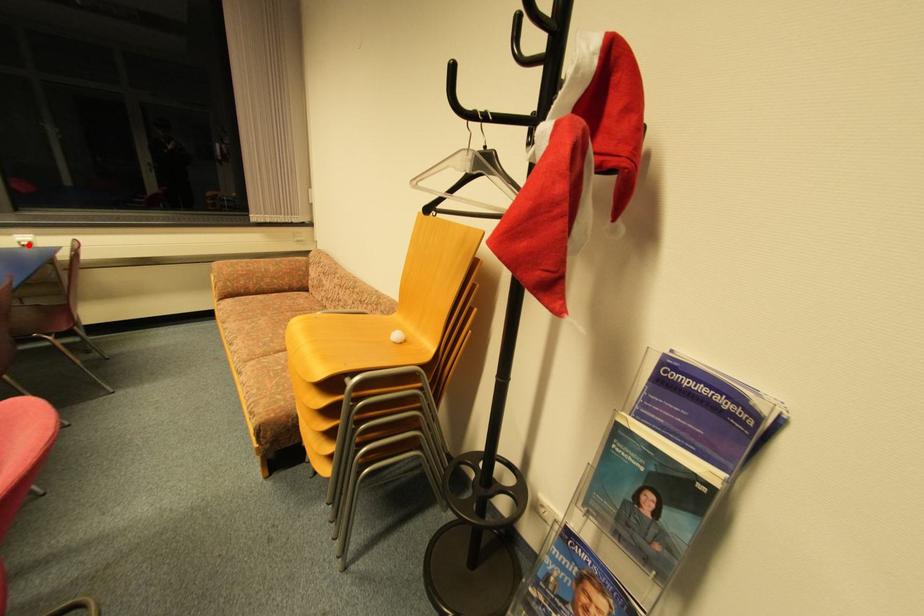
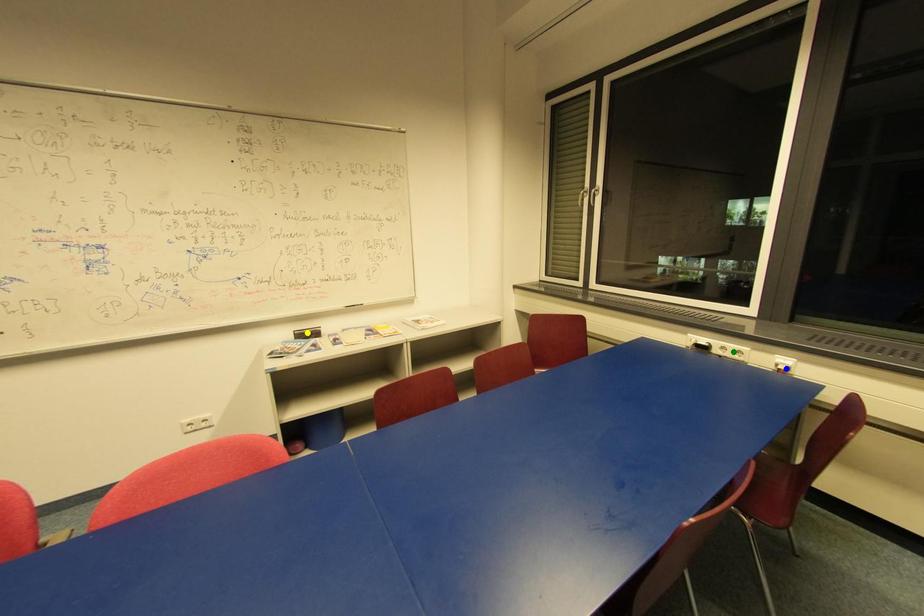
Question: I am providing you with two images of the same scene from different viewpoints. A red point is marked on the first image. You are given multiple points on the second image. Which spot in image 2 lines up with the point in image 1?

Choices:
 (A) blue point
 (B) yellow point
 (C) green point

Answer: (A)